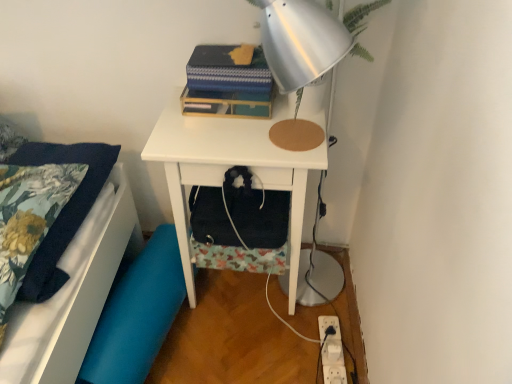
The image size is (512, 384). I want to click on free location above white matte nightstand at center (from a real-world perspective), so click(244, 126).